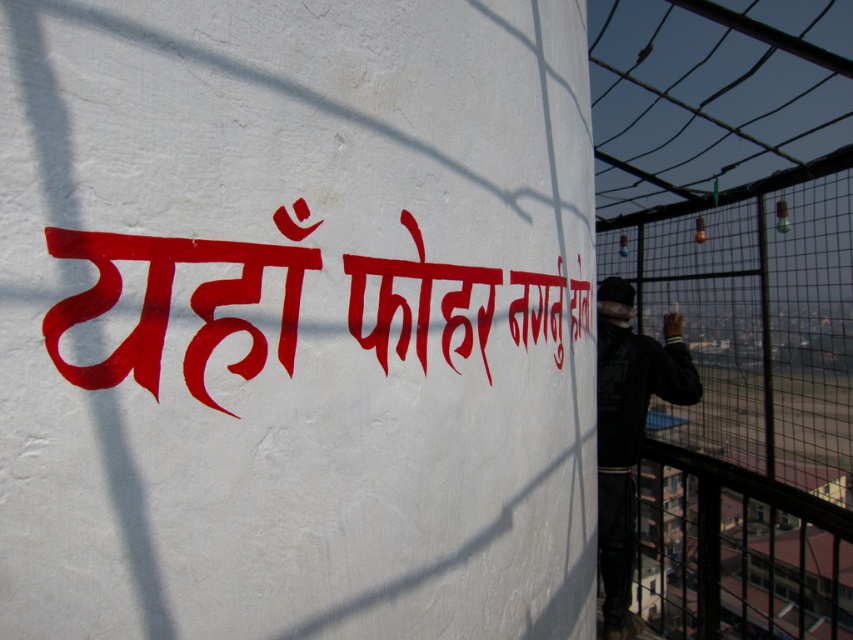
You are a painter who needs to assess the space between the black metal fence at right and the red painted text at center to determine if a ladder can fit. The ladder is 1.5 meters wide. Can the ladder fit between them?

The black metal fence at right is bigger than the red painted text at center, so the space between them may not be wide enough for a 1.5 meter ladder. Measure the exact distance before deciding.

You are a painter who needs to paint the black metal fence at right and the dark blue jacket at right. Which object requires a taller ladder to reach its top?

The black metal fence at right is much taller than the dark blue jacket at right, so you need a taller ladder for the black metal fence at right.